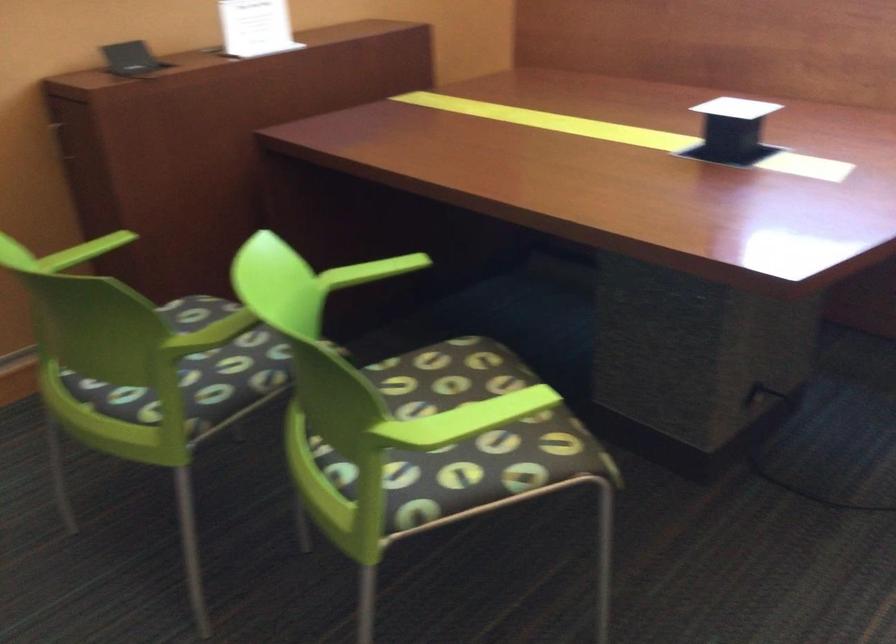
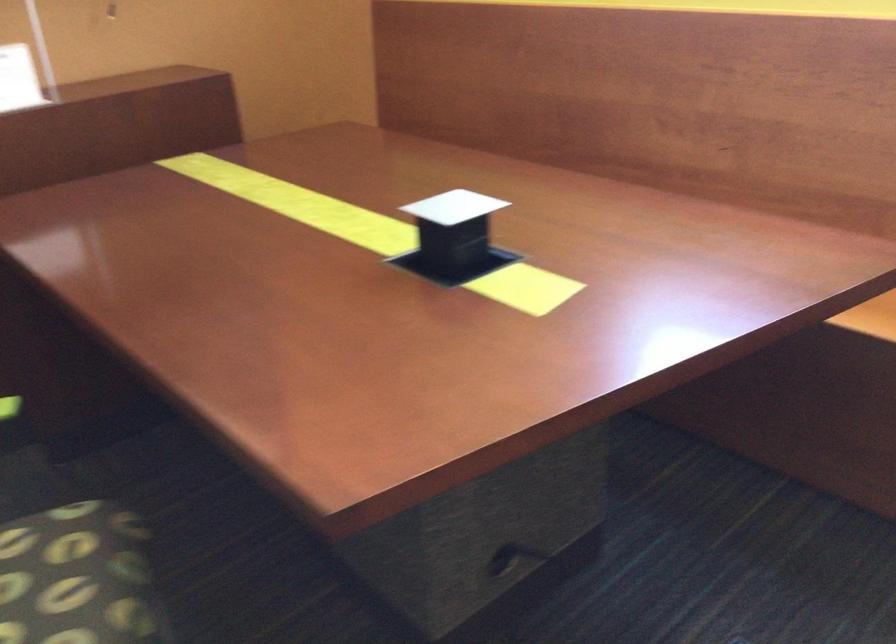
Find the pixel in the second image that matches [730,108] in the first image.

(453, 207)